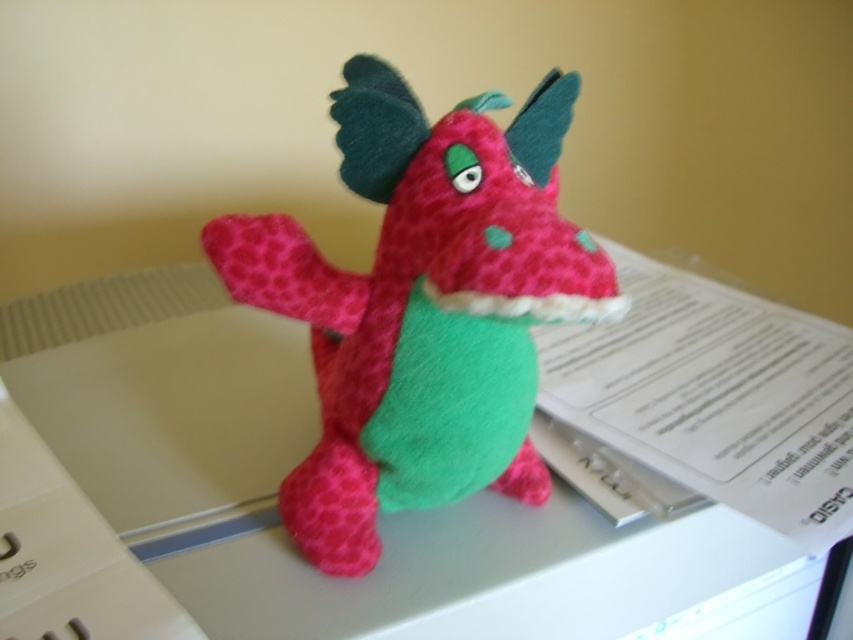
You are organizing a child birthday party and need to place a cake on the felt table at center and the matte pink plush dragon at center. According to the scene, which object should you move first to ensure the cake fits properly?

You should move the matte pink plush dragon at center first because the felt table at center is to the right of it, meaning the dragon is currently blocking the table where the cake needs to be placed.

You are organizing a child birthday party and need to place both the felt table at center and the matte pink plush dragon at center on a shelf. The shelf has limited space. Which object should you place first to ensure both fit?

The felt table at center is larger in size than the matte pink plush dragon at center, so you should place the felt table at center first to ensure both fit on the shelf.